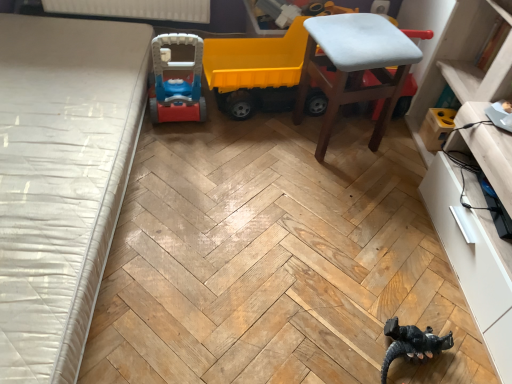
In order to click on vacant space in between light blue fabric stool at upper right and black matte toy dinosaur at lower right in this screenshot , I will do pos(369,230).